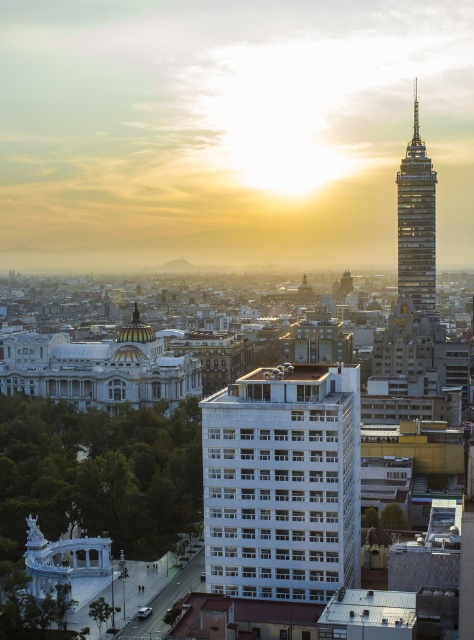
The image size is (474, 640). Describe the element at coordinates (282, 483) in the screenshot. I see `white smooth building at center` at that location.

Can you confirm if white smooth building at center is positioned below shiny glass tower at upper right?

Indeed, white smooth building at center is positioned under shiny glass tower at upper right.

The image size is (474, 640). What do you see at coordinates (282, 483) in the screenshot? I see `white smooth building at center` at bounding box center [282, 483].

At what (x,y) coordinates should I click in order to perform the action: click on white smooth building at center. Please return your answer as a coordinate pair (x, y). The width and height of the screenshot is (474, 640). Looking at the image, I should click on (282, 483).